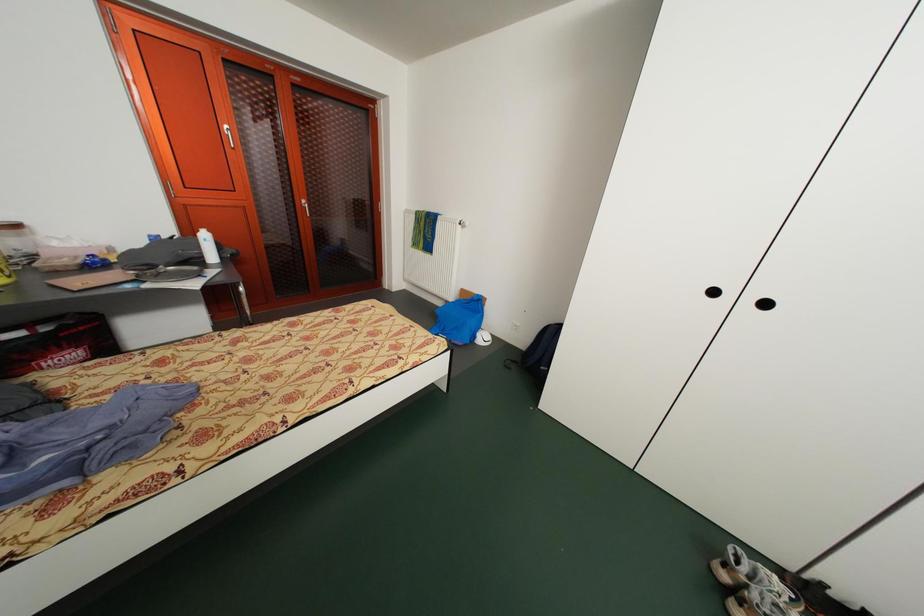
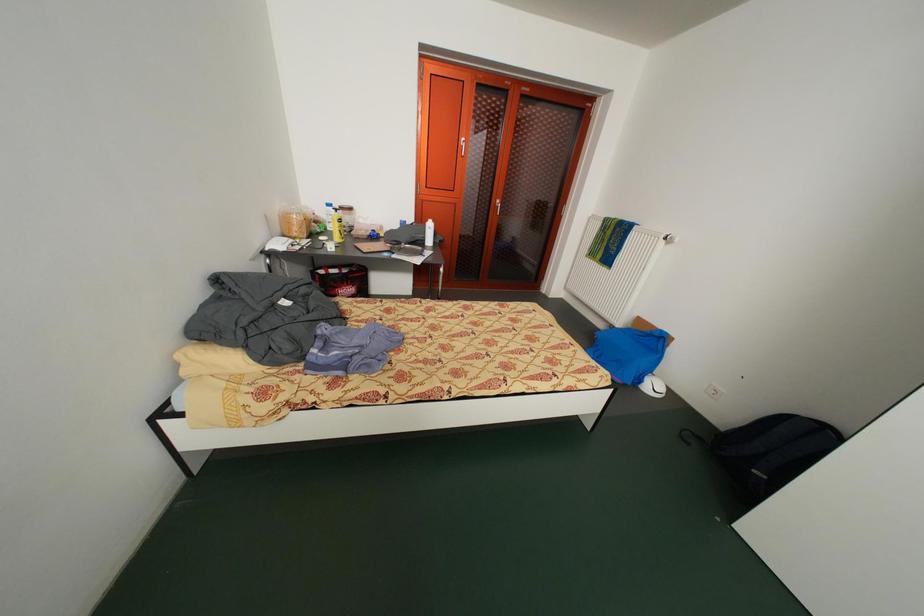
Question: How did the camera likely rotate?

Choices:
 (A) Left
 (B) Right
 (C) Up
 (D) Down

Answer: (A)